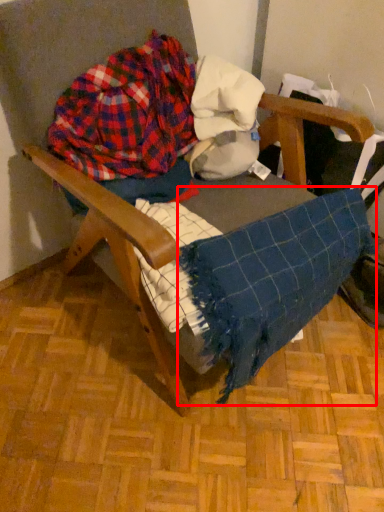
Question: In this image, where is blanket (annotated by the red box) located relative to flannel?

Choices:
 (A) right
 (B) left

Answer: (A)